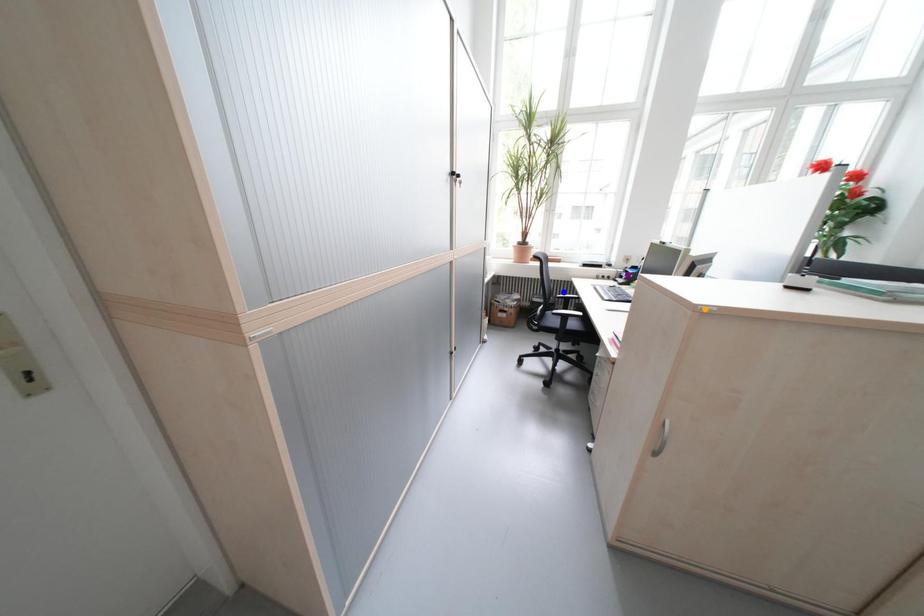
Order these from farthest to nearest:
orange point
purple point
blue point

blue point < purple point < orange point